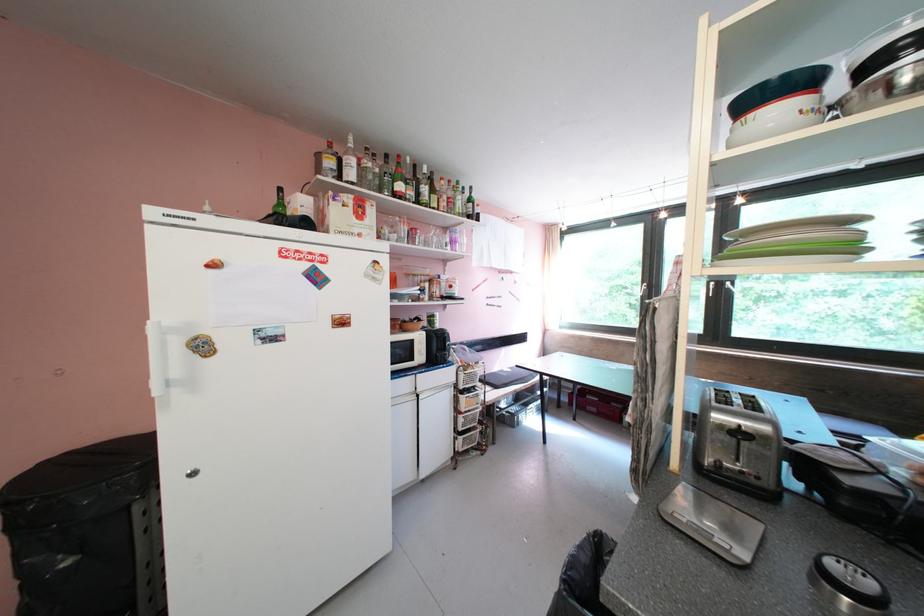
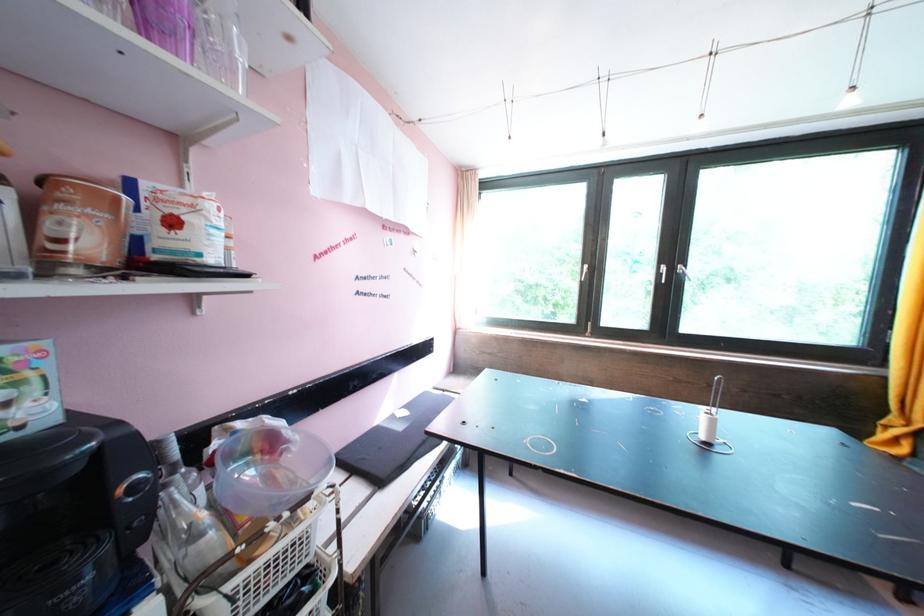
Where in the second image is the point corresponding to pixel 444 284 from the first image?

(78, 196)